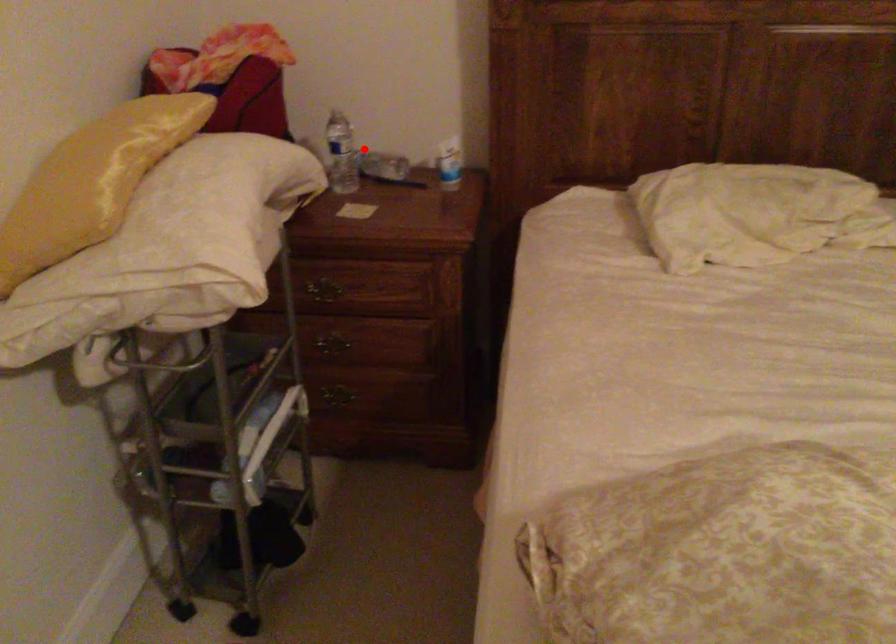
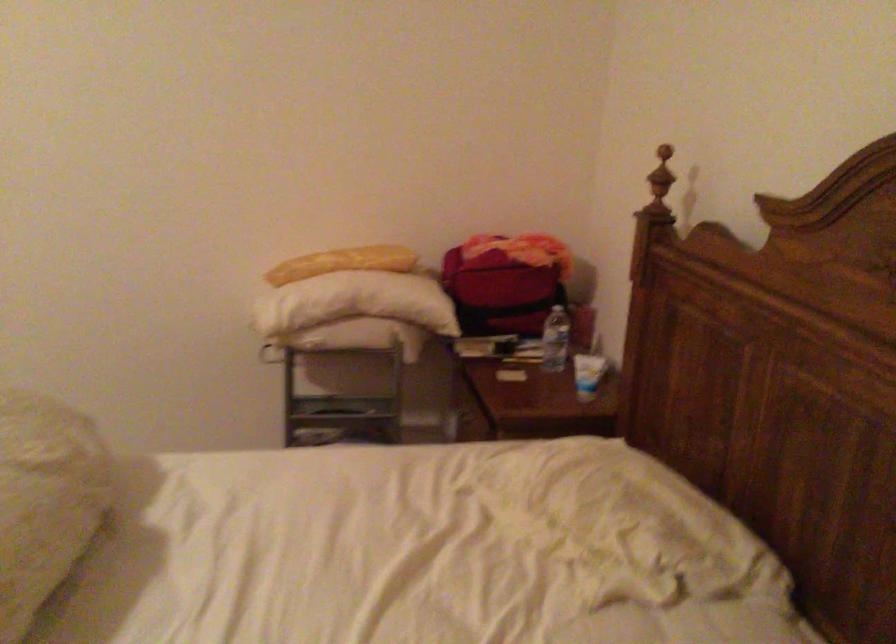
Question: I am providing you with two images of the same scene from different viewpoints. Given a red point in image1, look at the same physical point in image2. Is it:

Choices:
 (A) Closer to the viewpoint
 (B) Farther from the viewpoint

Answer: (B)